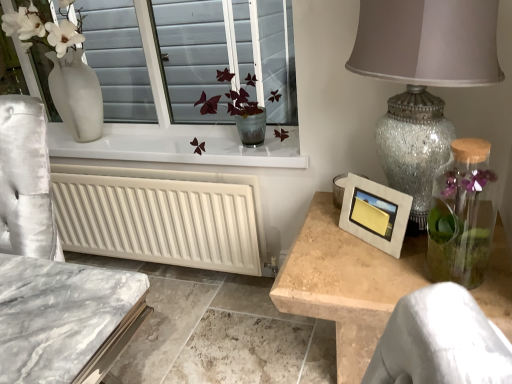
Question: From a real-world perspective, relative to crackle glass lampshade at right, is translucent glass vase at center vertically above or below?

Choices:
 (A) below
 (B) above

Answer: (A)

Question: From the image's perspective, is translucent glass vase at center above or below crackle glass lampshade at right?

Choices:
 (A) below
 (B) above

Answer: (B)

Question: Which is farther from the clear glass vase at right?

Choices:
 (A) crackle glass lampshade at right
 (B) translucent glass vase at center
 (C) white matte radiator at lower left
 (D) matte silver picture frame at right

Answer: (C)

Question: Which object is positioned closest to the translucent glass vase at center?

Choices:
 (A) matte silver picture frame at right
 (B) crackle glass lampshade at right
 (C) white matte radiator at lower left
 (D) clear glass vase at right

Answer: (C)